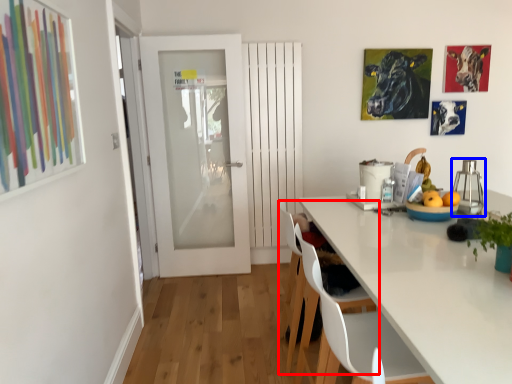
Question: Among these objects, which one is farthest to the camera, chair (highlighted by a red box) or appliance (highlighted by a blue box)?

Choices:
 (A) chair
 (B) appliance

Answer: (A)